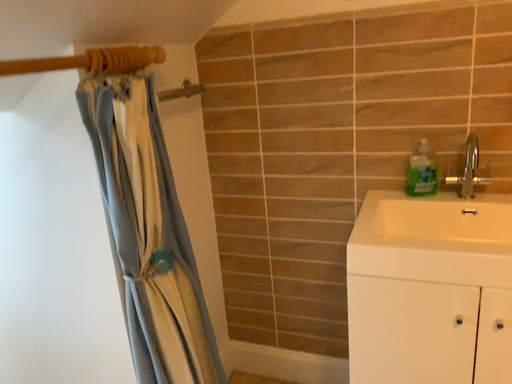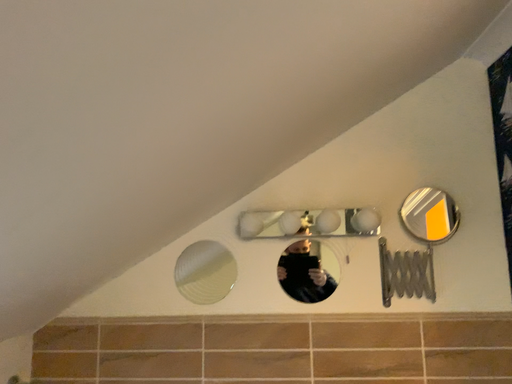
Question: How did the camera likely rotate when shooting the video?

Choices:
 (A) rotated right
 (B) rotated left

Answer: (A)